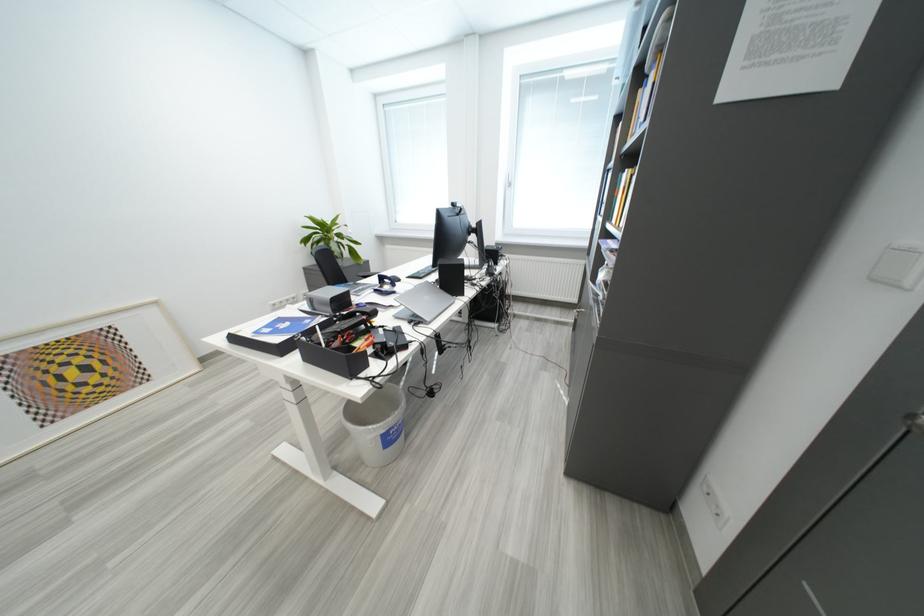
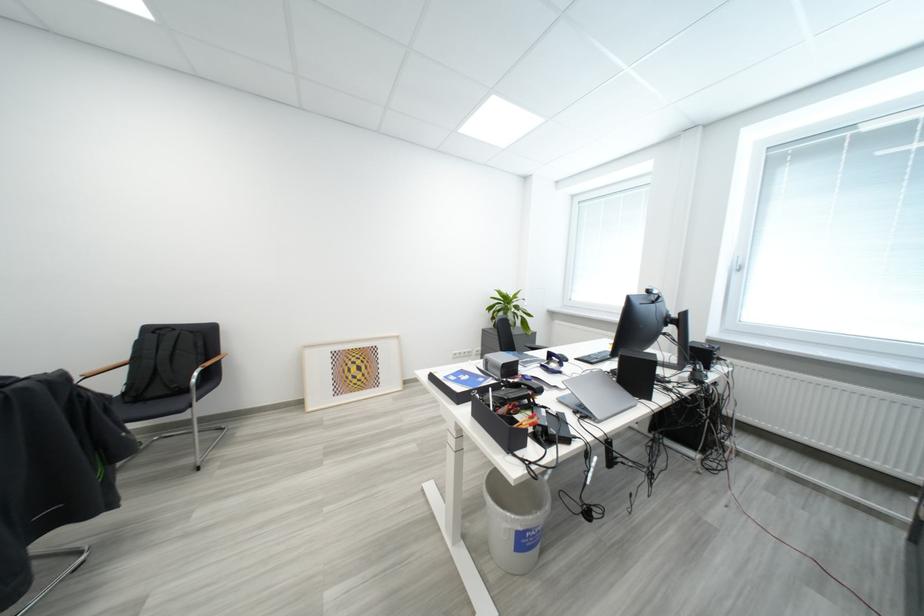
Question: Based on the continuous images, in which direction is the camera rotating? Reply with the corresponding letter.

Choices:
 (A) Left
 (B) Right
 (C) Up
 (D) Down

Answer: (A)